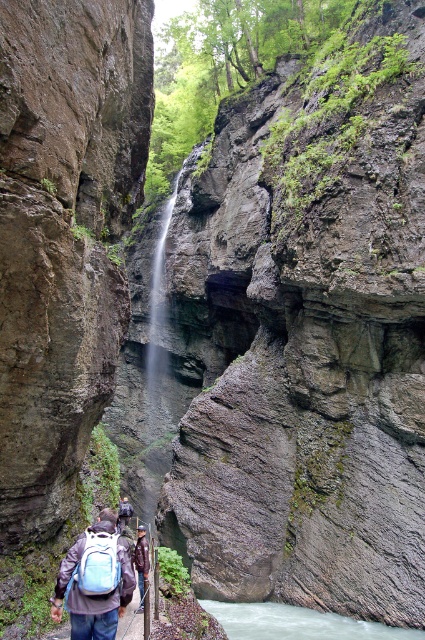
You are a hiker standing on the path in the canyon. You see the white smooth river at center and the dark blue backpack at center. Which object is located to the left of the other?

A: The white smooth river at center is to the right of dark blue backpack at center, so the dark blue backpack at center is to the left of the white smooth river at center.

You are a hiker standing at the edge of the canyon and notice the light blue fabric backpack at lower center. If you want to move towards the waterfall in the center, will you have to walk around the backpack?

The light blue fabric backpack at lower center is located at point (98,564), which is near the edge of the canyon. Since the path is narrow and the backpack is positioned at the lower center, you would need to carefully navigate around it to reach the waterfall in the center.